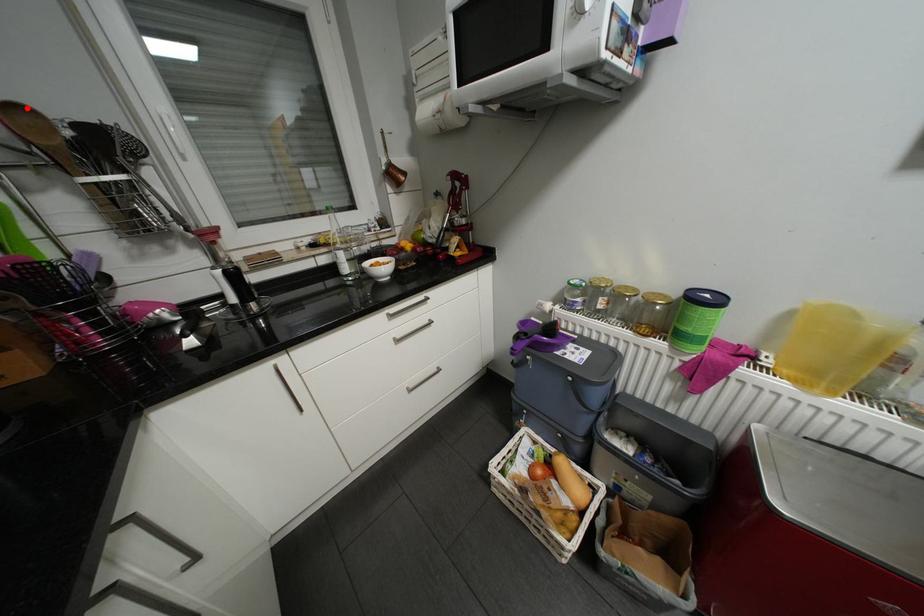
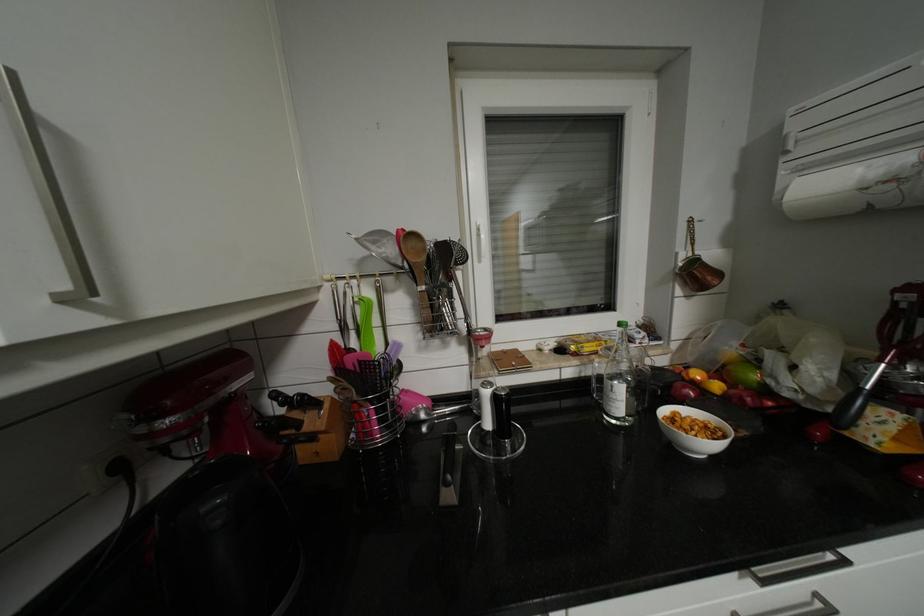
Locate, in the second image, the point that corresponds to the highlighted location in the first image.

(421, 235)